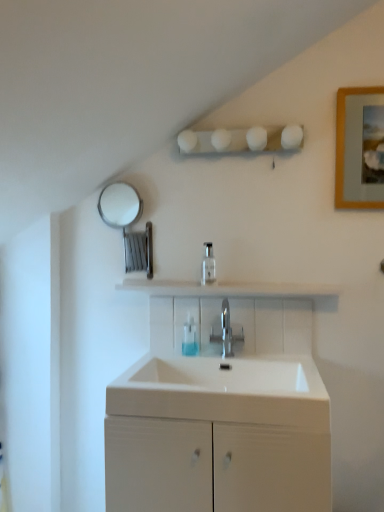
Locate an element on the screen. The width and height of the screenshot is (384, 512). unoccupied region to the right of white glossy soap dispenser at center is located at coordinates (258, 283).